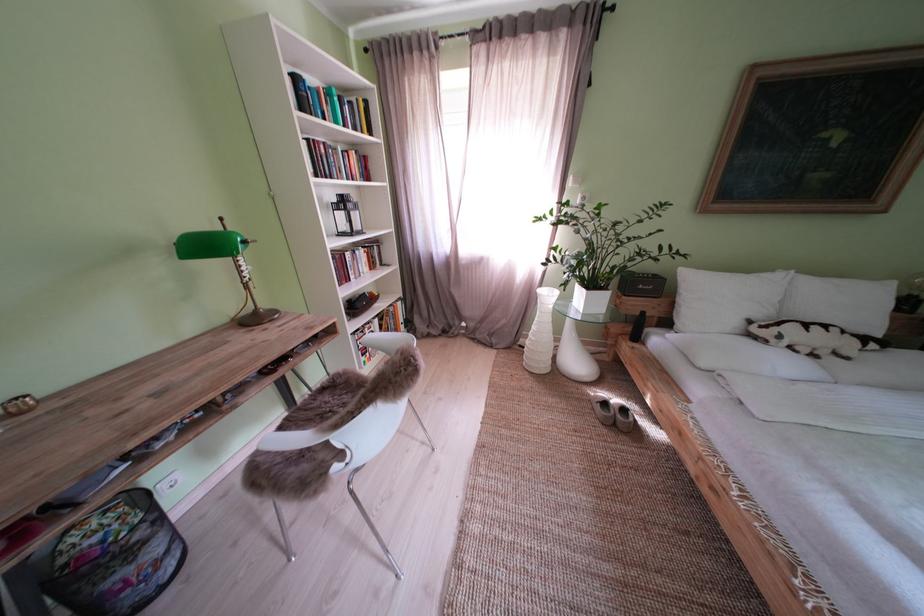
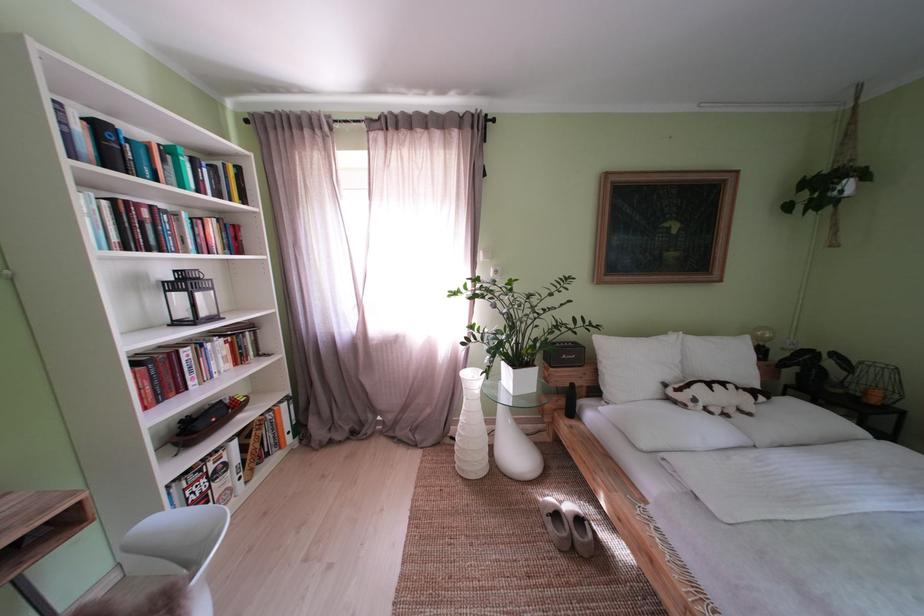
Locate, in the second image, the point that corresponds to (x=346, y=155) in the first image.

(188, 220)